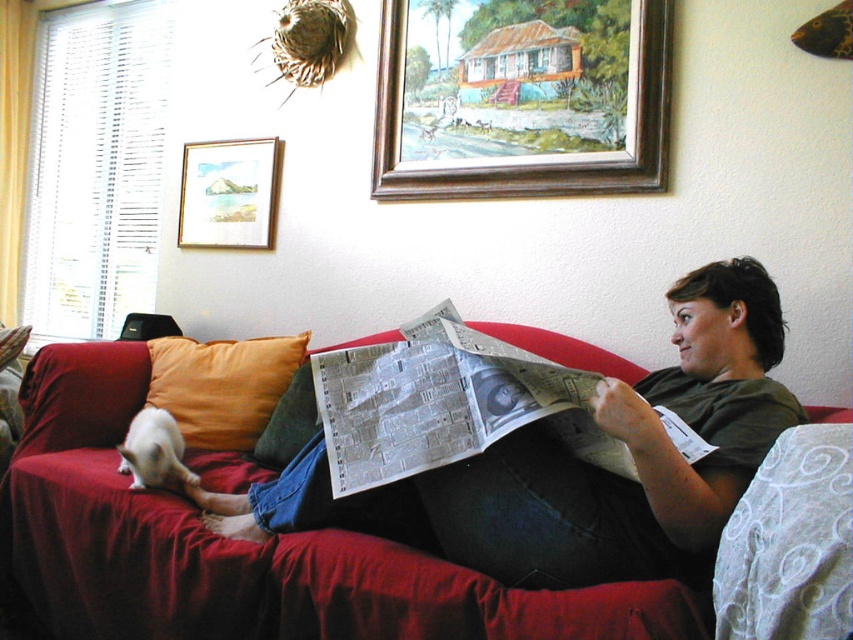
Question: Is wooden picture frame at upper center to the right of velvet orange pillow at center from the viewer's perspective?

Choices:
 (A) no
 (B) yes

Answer: (B)

Question: Does orange fabric pillow at left appear over velvet orange pillow at center?

Choices:
 (A) yes
 (B) no

Answer: (A)

Question: Does orange fabric pillow at left have a lesser width compared to gold-framed picture at upper left?

Choices:
 (A) no
 (B) yes

Answer: (A)

Question: Among these objects, which one is nearest to the camera?

Choices:
 (A) gold-framed picture at upper left
 (B) orange fabric pillow at left

Answer: (B)

Question: Which point is farther from the camera taking this photo?

Choices:
 (A) (425, 51)
 (B) (267, 387)
 (C) (451, 397)
 (D) (287, 451)

Answer: (A)

Question: Which object appears closest to the camera in this image?

Choices:
 (A) white glossy newspaper at center
 (B) wooden picture frame at upper center
 (C) gold-framed picture at upper left
 (D) velvet orange pillow at center

Answer: (A)